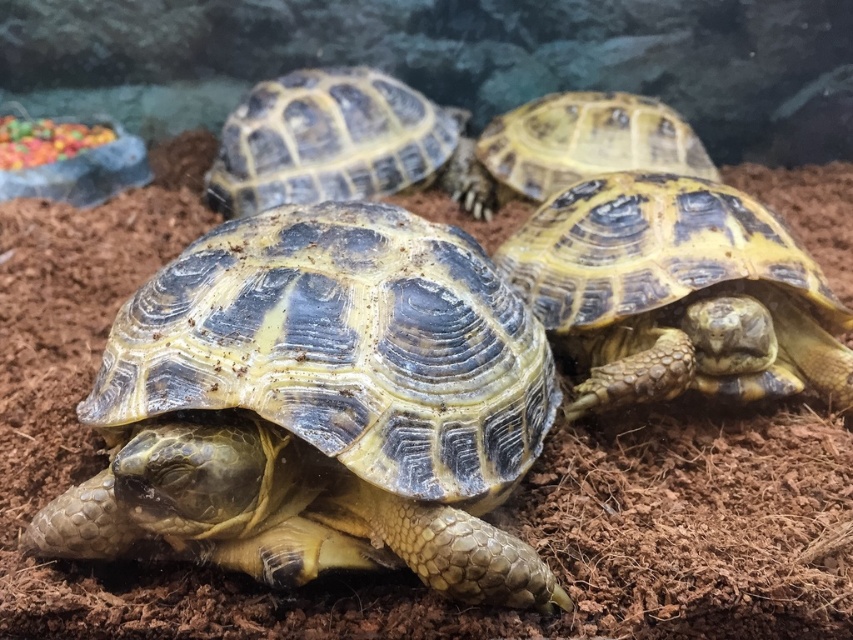
Question: Among these objects, which one is farthest from the camera?

Choices:
 (A) yellowish-brown scaly shell at center
 (B) yellowish-brown scaly tortoise at center
 (C) yellowish-brown scaly shell at center-right

Answer: (A)

Question: Is yellowish-brown scaly shell at center behind yellow scaly tortoise at upper right?

Choices:
 (A) yes
 (B) no

Answer: (B)

Question: Is yellowish-brown scaly shell at center-right above yellowish-brown scaly shell at center?

Choices:
 (A) yes
 (B) no

Answer: (B)

Question: Which of the following is the closest to the observer?

Choices:
 (A) yellowish-brown scaly shell at center-right
 (B) yellowish-brown scaly tortoise at center
 (C) yellow scaly tortoise at upper right
 (D) yellowish-brown scaly shell at center

Answer: (B)

Question: Does yellowish-brown scaly tortoise at center appear under yellowish-brown scaly shell at center-right?

Choices:
 (A) no
 (B) yes

Answer: (B)

Question: Based on their relative distances, which object is nearer to the yellowish-brown scaly tortoise at center?

Choices:
 (A) yellow scaly tortoise at upper right
 (B) yellowish-brown scaly shell at center-right
 (C) yellowish-brown scaly shell at center

Answer: (B)